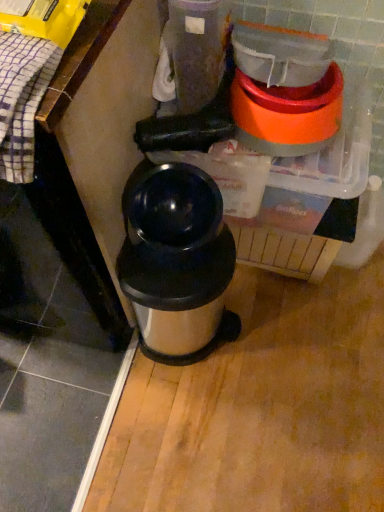
The height and width of the screenshot is (512, 384). In order to click on vacant area that lies in front of stainless steel thermos at center in this screenshot , I will do `click(193, 418)`.